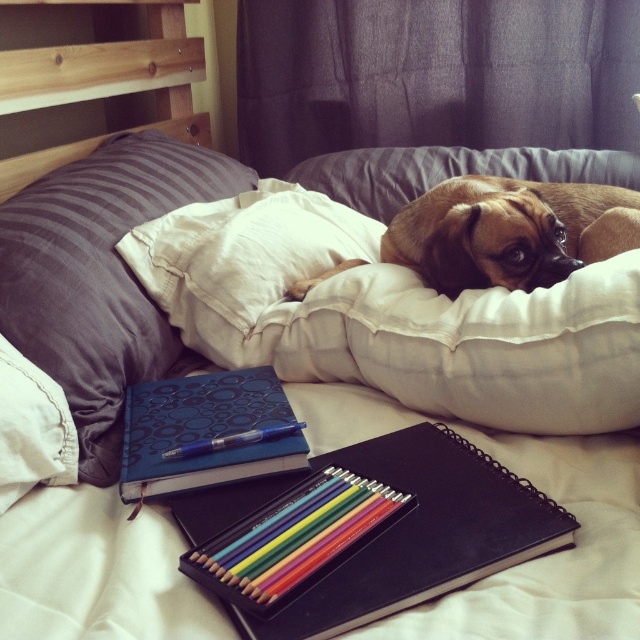
Does blue fabric pillow at left appear over blue textured notebook at center?

Yes.

Does blue fabric pillow at left appear on the right side of blue textured notebook at center?

Incorrect, blue fabric pillow at left is not on the right side of blue textured notebook at center.

In order to click on blue fabric pillow at left in this screenshot , I will do `click(99, 276)`.

The image size is (640, 640). In order to click on blue fabric pillow at left in this screenshot , I will do `click(99, 276)`.

Is point (513, 310) positioned after point (266, 433)?

Yes, it is.

Who is more distant from viewer, (202, 221) or (253, 433)?

The point (202, 221) is behind.

Identify the location of white soft pillow at center. (390, 316).

What do you see at coordinates (99, 276) in the screenshot? I see `blue fabric pillow at left` at bounding box center [99, 276].

Is blue fabric pillow at left to the right of blue metallic pen at center from the viewer's perspective?

In fact, blue fabric pillow at left is to the left of blue metallic pen at center.

What do you see at coordinates (99, 276) in the screenshot?
I see `blue fabric pillow at left` at bounding box center [99, 276].

Image resolution: width=640 pixels, height=640 pixels. Identify the location of blue fabric pillow at left. (99, 276).